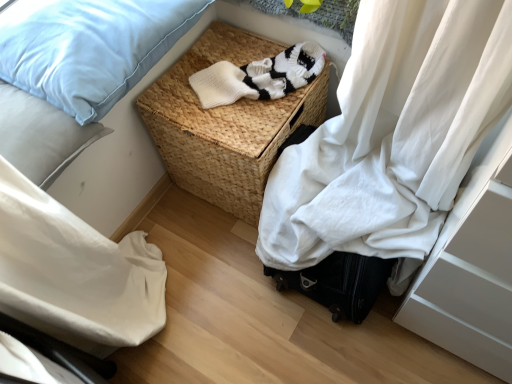
Question: Considering the relative sizes of light blue fabric pillow at upper left, acting as the 2th pillow starting from the bottom, and light blue fabric pillow at upper left, which is the first pillow from bottom to top, in the image provided, is light blue fabric pillow at upper left, acting as the 2th pillow starting from the bottom, taller than light blue fabric pillow at upper left, which is the first pillow from bottom to top,?

Choices:
 (A) yes
 (B) no

Answer: (B)

Question: Is light blue fabric pillow at upper left, acting as the 2th pillow starting from the bottom, not within light blue fabric pillow at upper left, which is the first pillow from bottom to top?

Choices:
 (A) no
 (B) yes

Answer: (B)

Question: Considering the relative sizes of light blue fabric pillow at upper left, the 1th pillow positioned from the top, and light blue fabric pillow at upper left, which is the first pillow from bottom to top, in the image provided, is light blue fabric pillow at upper left, the 1th pillow positioned from the top, wider than light blue fabric pillow at upper left, which is the first pillow from bottom to top,?

Choices:
 (A) no
 (B) yes

Answer: (B)

Question: Can you confirm if light blue fabric pillow at upper left, the 1th pillow positioned from the top, is positioned to the right of light blue fabric pillow at upper left, which is the first pillow from bottom to top?

Choices:
 (A) no
 (B) yes

Answer: (B)

Question: From the image's perspective, is light blue fabric pillow at upper left, the 1th pillow positioned from the top, located beneath light blue fabric pillow at upper left, which is the first pillow from bottom to top?

Choices:
 (A) yes
 (B) no

Answer: (B)

Question: Does light blue fabric pillow at upper left, the 1th pillow positioned from the top, have a lesser width compared to light blue fabric pillow at upper left, marked as the second pillow in a top-to-bottom arrangement?

Choices:
 (A) no
 (B) yes

Answer: (A)

Question: Considering the relative positions of light blue fabric pillow at upper left, marked as the second pillow in a top-to-bottom arrangement, and white knitted sweater at center in the image provided, is light blue fabric pillow at upper left, marked as the second pillow in a top-to-bottom arrangement, in front of white knitted sweater at center?

Choices:
 (A) no
 (B) yes

Answer: (B)

Question: Is light blue fabric pillow at upper left, marked as the second pillow in a top-to-bottom arrangement, shorter than white knitted sweater at center?

Choices:
 (A) no
 (B) yes

Answer: (A)

Question: From the image's perspective, is light blue fabric pillow at upper left, marked as the second pillow in a top-to-bottom arrangement, located beneath white knitted sweater at center?

Choices:
 (A) yes
 (B) no

Answer: (A)

Question: Does light blue fabric pillow at upper left, marked as the second pillow in a top-to-bottom arrangement, turn towards white knitted sweater at center?

Choices:
 (A) no
 (B) yes

Answer: (A)

Question: From a real-world perspective, is light blue fabric pillow at upper left, marked as the second pillow in a top-to-bottom arrangement, on white knitted sweater at center?

Choices:
 (A) yes
 (B) no

Answer: (A)

Question: Can you confirm if light blue fabric pillow at upper left, marked as the second pillow in a top-to-bottom arrangement, is wider than white knitted sweater at center?

Choices:
 (A) no
 (B) yes

Answer: (B)

Question: From a real-world perspective, is woven brown picnic basket at center on top of light blue fabric pillow at upper left, the 1th pillow positioned from the top?

Choices:
 (A) yes
 (B) no

Answer: (B)